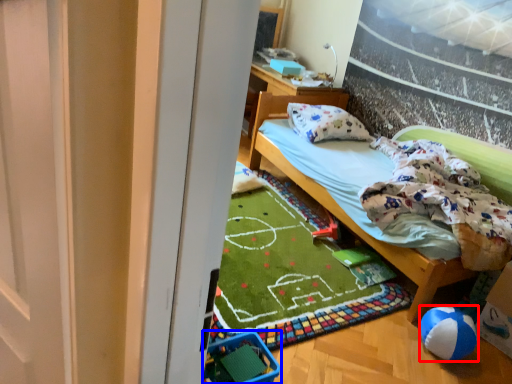
Question: Which object is further to the camera taking this photo, ball (highlighted by a red box) or baby carriage (highlighted by a blue box)?

Choices:
 (A) ball
 (B) baby carriage

Answer: (A)